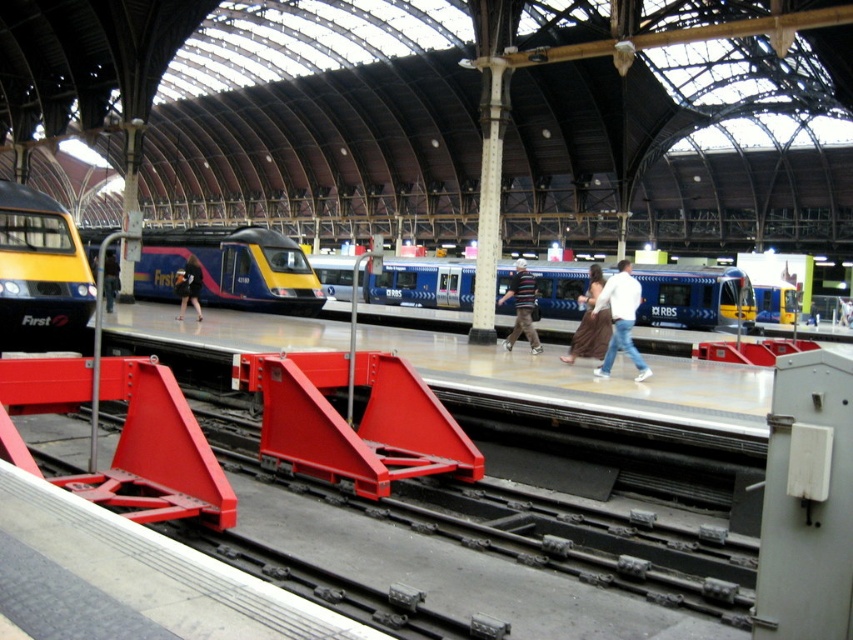
You are a fashion designer observing two people on a train station platform. You notice a striped sweater at center and a dark blue fabric jacket at center. Which clothing item appears larger in size?

The striped sweater at center is bigger than the dark blue fabric jacket at center.